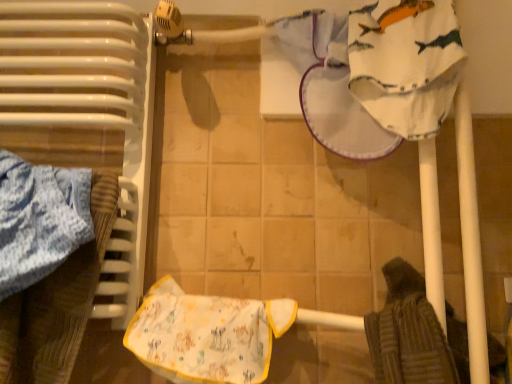
Question: From the image's perspective, is white glossy radiator at left over printed fabric bib at center?

Choices:
 (A) no
 (B) yes

Answer: (B)

Question: From the image's perspective, is white glossy radiator at left under printed fabric bib at center?

Choices:
 (A) no
 (B) yes

Answer: (A)

Question: Is white glossy radiator at left bigger than printed fabric bib at center?

Choices:
 (A) no
 (B) yes

Answer: (B)

Question: Considering the relative sizes of white glossy radiator at left and printed fabric bib at center in the image provided, is white glossy radiator at left wider than printed fabric bib at center?

Choices:
 (A) no
 (B) yes

Answer: (B)

Question: Does white glossy radiator at left contain printed fabric bib at center?

Choices:
 (A) no
 (B) yes

Answer: (A)

Question: Considering the relative positions of white glossy radiator at left and printed fabric bib at center in the image provided, is white glossy radiator at left to the left of printed fabric bib at center from the viewer's perspective?

Choices:
 (A) no
 (B) yes

Answer: (B)

Question: Considering the relative positions of printed fabric bib at center and white glossy radiator at left in the image provided, is printed fabric bib at center to the left of white glossy radiator at left from the viewer's perspective?

Choices:
 (A) no
 (B) yes

Answer: (A)

Question: Is white glossy radiator at left at the back of printed fabric bib at center?

Choices:
 (A) no
 (B) yes

Answer: (A)

Question: Does printed fabric bib at center have a lesser height compared to white glossy radiator at left?

Choices:
 (A) yes
 (B) no

Answer: (A)

Question: Is printed fabric bib at center bigger than white glossy radiator at left?

Choices:
 (A) yes
 (B) no

Answer: (B)

Question: Is printed fabric bib at center aimed at white glossy radiator at left?

Choices:
 (A) no
 (B) yes

Answer: (A)

Question: Is printed fabric bib at center behind white glossy radiator at left?

Choices:
 (A) no
 (B) yes

Answer: (B)

Question: From the image's perspective, is printed fabric bib at center positioned above or below white glossy radiator at left?

Choices:
 (A) below
 (B) above

Answer: (A)